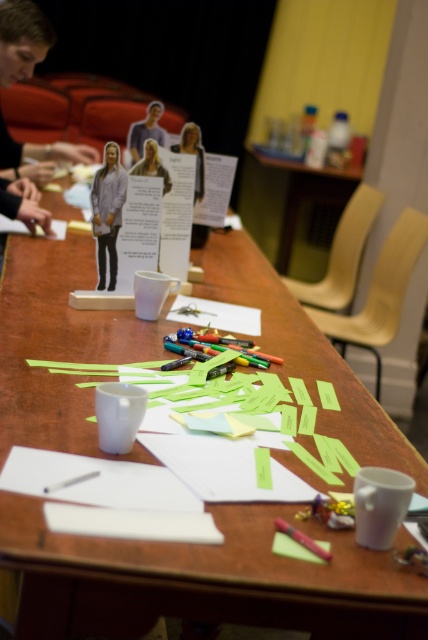
Is matte white shirt at center below matte gray figure at upper left?

Indeed, matte white shirt at center is positioned under matte gray figure at upper left.

How far apart are matte white shirt at center and matte gray figure at upper left?

matte white shirt at center is 29.87 inches away from matte gray figure at upper left.

Which is behind, point (115, 275) or point (131, 154)?

The point (131, 154) is behind.

This screenshot has height=640, width=428. I want to click on matte white shirt at center, so click(107, 211).

Is matte white shirt at center positioned behind pink matte pen at lower center?

Yes, it is.

Consider the image. Does matte white shirt at center appear on the right side of pink matte pen at lower center?

No, matte white shirt at center is not to the right of pink matte pen at lower center.

Is point (107, 202) farther from camera compared to point (297, 541)?

Yes, it is.

Find the location of `matte white shirt at center`. matte white shirt at center is located at coordinates (x=107, y=211).

Between matte gray figure at upper left and pink matte pen at lower center, which one is positioned higher?

matte gray figure at upper left

Who is more forward, (142, 128) or (297, 544)?

Positioned in front is point (297, 544).

Find the location of a particular element. The image size is (428, 640). matte gray figure at upper left is located at coordinates coord(145,131).